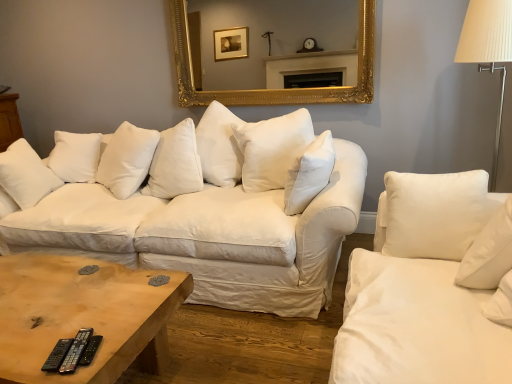
The width and height of the screenshot is (512, 384). I want to click on spots to the right of black rubber remote at lower left, arranged as the first remote when viewed from the left, so click(x=115, y=337).